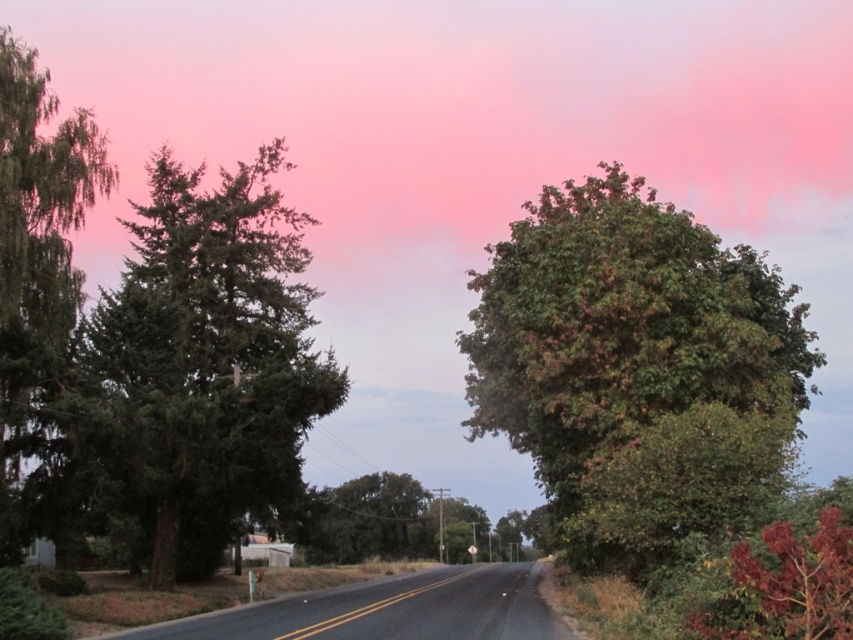
Question: Among these points, which one is farthest from the camera?

Choices:
 (A) (589, 241)
 (B) (4, 372)
 (C) (151, 316)
 (D) (428, 499)

Answer: (D)

Question: Is green leafy tree at left below green leafy tree at center?

Choices:
 (A) no
 (B) yes

Answer: (A)

Question: Based on their relative distances, which object is nearer to the green leafy tree at right?

Choices:
 (A) green leafy tree at left
 (B) green leafy tree at center

Answer: (A)

Question: Does green matte tree at left have a smaller size compared to green leafy tree at left?

Choices:
 (A) no
 (B) yes

Answer: (A)

Question: Which is farther from the green leafy tree at right?

Choices:
 (A) green leafy tree at center
 (B) green leafy tree at left
 (C) green matte tree at left

Answer: (A)

Question: Can you confirm if green leafy tree at right is smaller than green leafy tree at left?

Choices:
 (A) no
 (B) yes

Answer: (A)